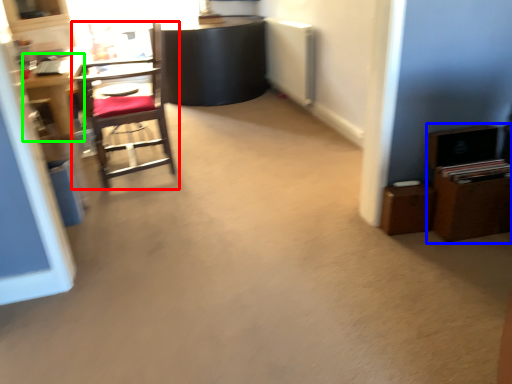
Question: Estimate the real-world distances between objects in this image. Which object is closer to chair (highlighted by a red box), dresser (highlighted by a blue box) or desk (highlighted by a green box)?

Choices:
 (A) dresser
 (B) desk

Answer: (B)